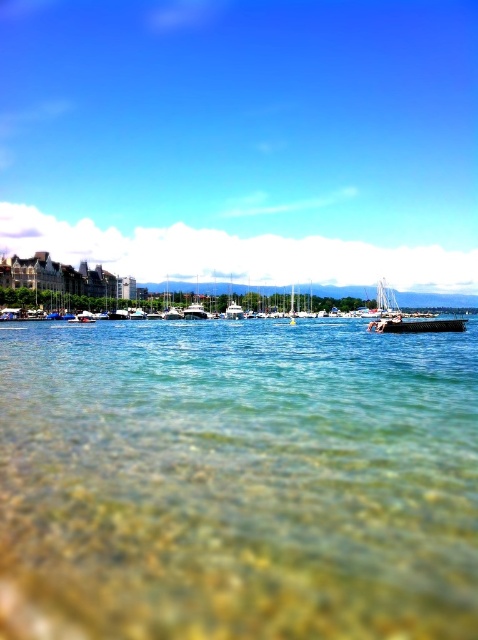
Question: Considering the relative positions of clear water at center and transparent water at center in the image provided, where is clear water at center located with respect to transparent water at center?

Choices:
 (A) right
 (B) left

Answer: (B)

Question: Can you confirm if clear water at center is positioned to the right of transparent water at center?

Choices:
 (A) no
 (B) yes

Answer: (A)

Question: Is clear water at center behind transparent water at center?

Choices:
 (A) yes
 (B) no

Answer: (B)

Question: Among these points, which one is farthest from the camera?

Choices:
 (A) (57, 566)
 (B) (345, 22)

Answer: (B)

Question: Which point is farther to the camera?

Choices:
 (A) (352, 124)
 (B) (67, 609)

Answer: (A)